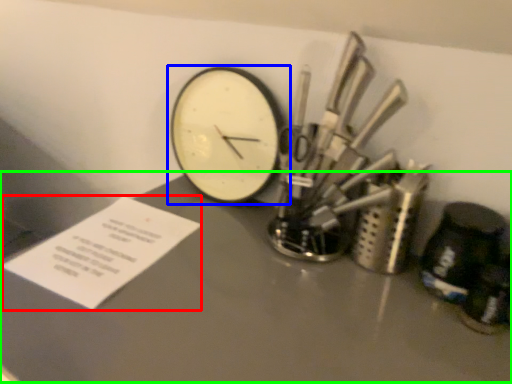
Question: Estimate the real-world distances between objects in this image. Which object is farther from paper (highlighted by a red box), wall clock (highlighted by a blue box) or table (highlighted by a green box)?

Choices:
 (A) wall clock
 (B) table

Answer: (A)